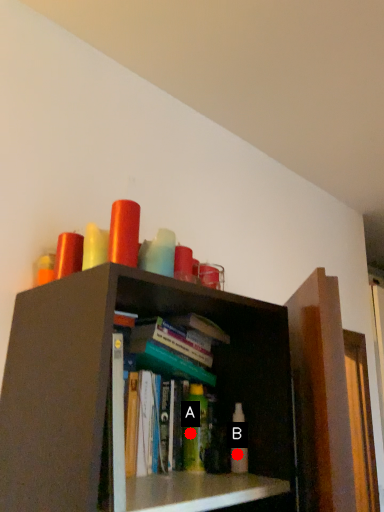
Question: Two points are circled on the image, labeled by A and B beside each circle. Among these points, which one is nearest to the camera?

Choices:
 (A) A is closer
 (B) B is closer

Answer: (B)